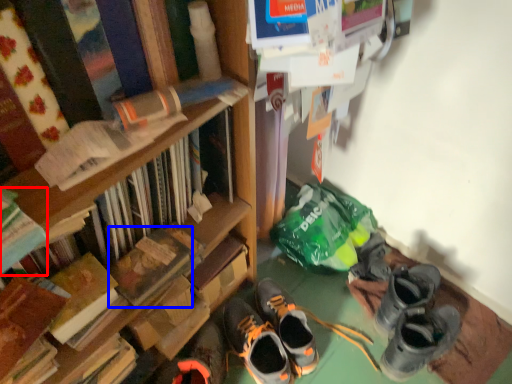
Question: Which point is closer to the camera, book (highlighted by a red box) or paperback book (highlighted by a blue box)?

Choices:
 (A) book
 (B) paperback book

Answer: (A)